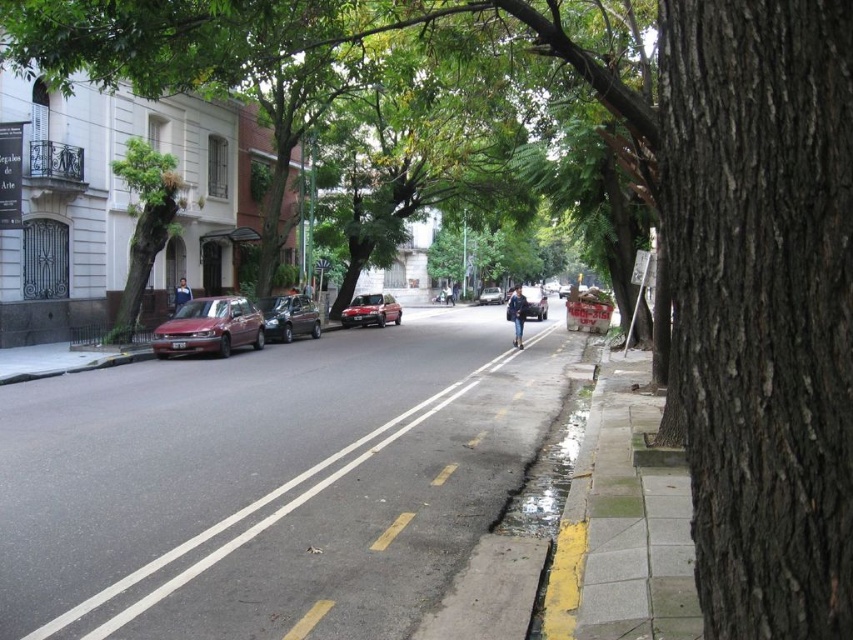
Question: Among these points, which one is nearest to the camera?

Choices:
 (A) (766, 390)
 (B) (239, 310)

Answer: (A)

Question: Which of the following is the closest to the observer?

Choices:
 (A) matte red car at center
 (B) matte red car at center-left
 (C) shiny red car at center
 (D) green leafy tree at left

Answer: (B)

Question: Where is dark brown textured bark at right located in relation to shiny red car at center in the image?

Choices:
 (A) left
 (B) right

Answer: (B)

Question: Considering the relative positions of asphalt at center and satin dark gray car at center in the image provided, where is asphalt at center located with respect to satin dark gray car at center?

Choices:
 (A) above
 (B) below

Answer: (B)

Question: Is dark brown textured bark at right positioned behind green leafy tree at left?

Choices:
 (A) no
 (B) yes

Answer: (A)

Question: Which is farther from the matte red car at center-left?

Choices:
 (A) green leafy tree at left
 (B) matte black car at center
 (C) satin dark gray car at center
 (D) shiny red car at center

Answer: (D)